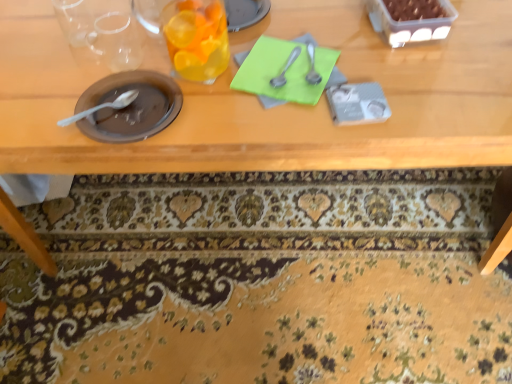
At what (x,y) coordinates should I click in order to perform the action: click on empty space that is ontop of green paper at center (from a real-world perspective). Please return your answer as a coordinate pair (x, y). Image resolution: width=512 pixels, height=384 pixels. Looking at the image, I should click on (287, 66).